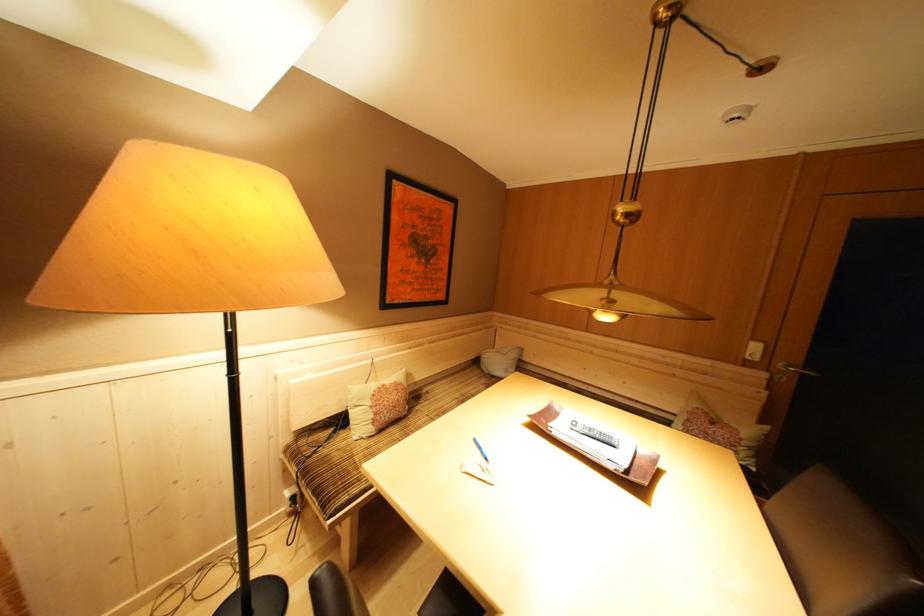
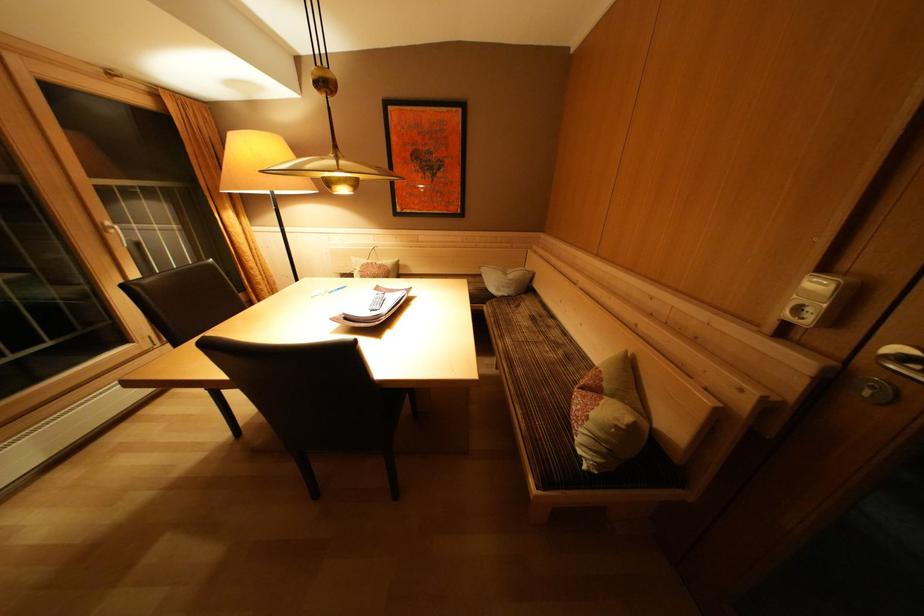
Locate, in the second image, the point that corresponds to (519,361) in the first image.

(517, 281)